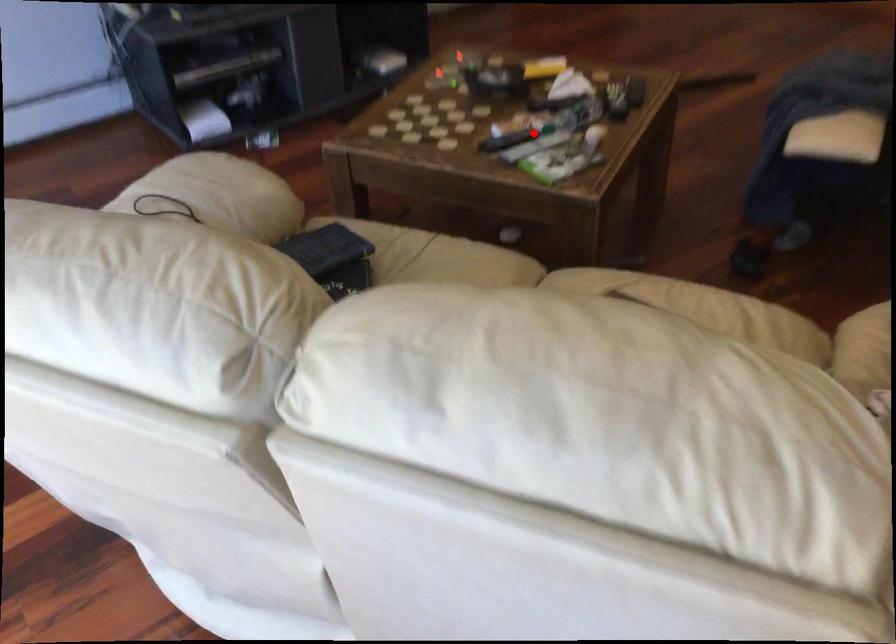
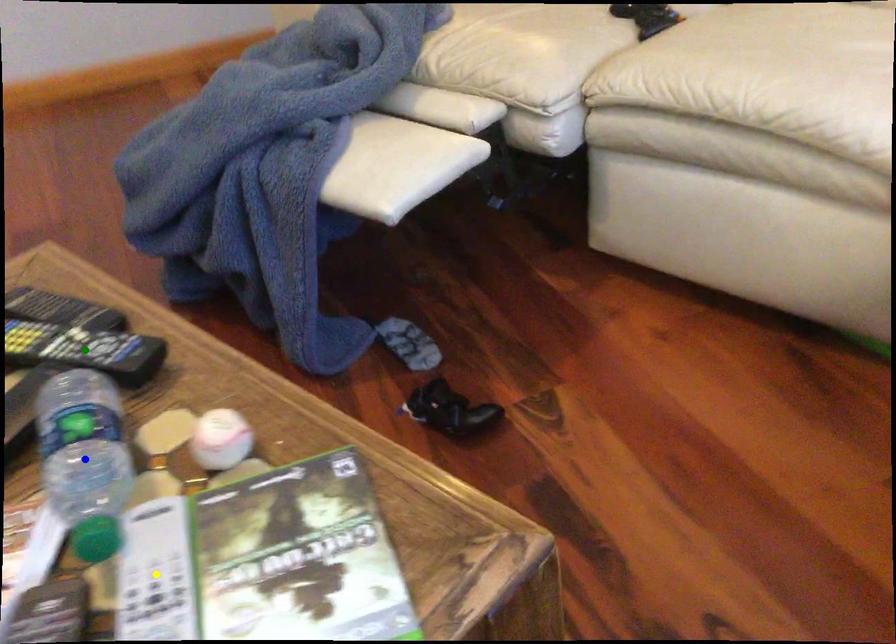
Question: I am providing you with two images of the same scene from different viewpoints. A red point is marked on the first image. You are given multiple points on the second image. Which point in image 2 represents the same 3d spot as the red point in image 1?

Choices:
 (A) green point
 (B) yellow point
 (C) blue point

Answer: (B)